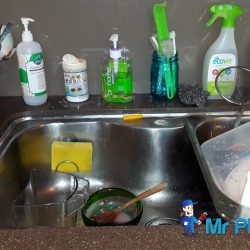
The width and height of the screenshot is (250, 250). In order to click on soap in this screenshot , I will do `click(119, 78)`.